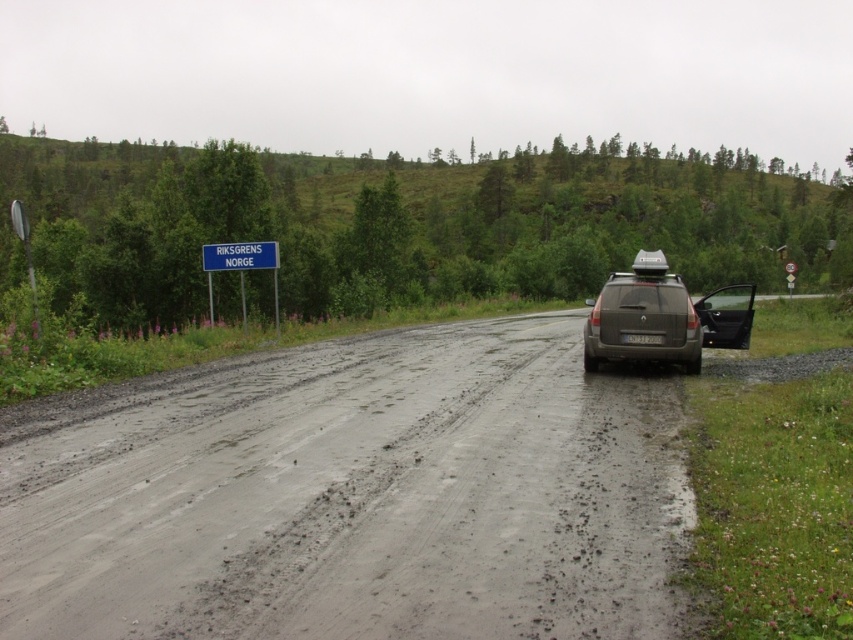
You are a delivery driver planning to drive your truck along the wet asphalt road at center. You notice the blue plastic sign at upper center ahead. Based on their sizes, which object will appear closer to you as you approach them?

The wet asphalt road at center will appear closer because it has a larger size compared to the blue plastic sign at upper center, making it seem nearer when viewed from a distance.

You are driving a car and see the satin silver suv at right and the white plastic license plate at center. Which object is wider?

The satin silver suv at right is wider than the white plastic license plate at center.